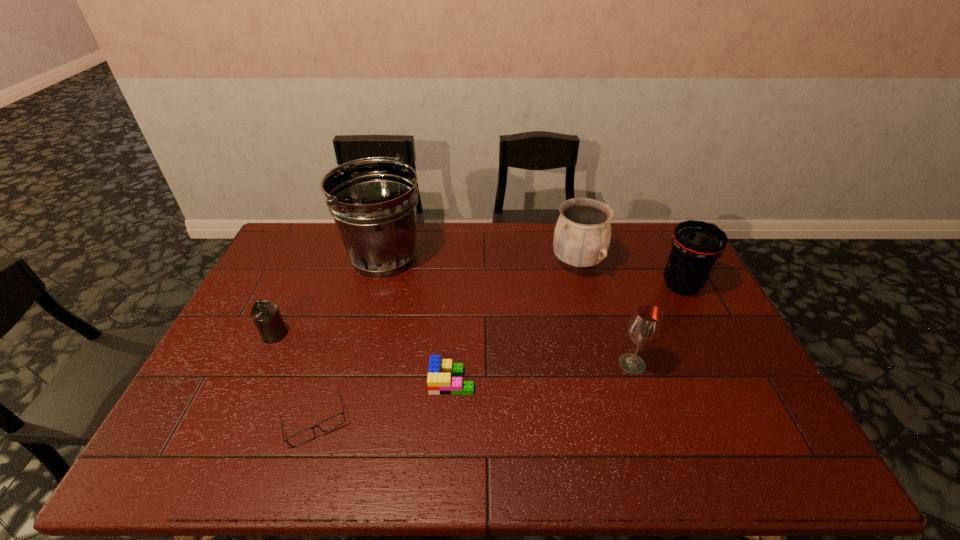
Where is `free spot between the wineglass and the urn`? free spot between the wineglass and the urn is located at coordinates (605, 314).

The width and height of the screenshot is (960, 540). In order to click on blank region between the fourth object from right to left and the urn in this screenshot , I will do (515, 322).

The height and width of the screenshot is (540, 960). Find the location of `free spot between the urn and the bucket`. free spot between the urn and the bucket is located at coordinates (480, 260).

Image resolution: width=960 pixels, height=540 pixels. Identify the location of the fifth closest object relative to the bucket. (644, 328).

I want to click on object that is the sixth nearest to the urn, so click(266, 316).

In order to click on vacant position in the image that satisfies the following two spatial constraints: 1. on the front side of the urn; 2. on the right side of the wineglass in this screenshot , I will do `click(604, 364)`.

I want to click on vacant space that satisfies the following two spatial constraints: 1. on the back side of the Lego; 2. on the right side of the wineglass, so click(453, 364).